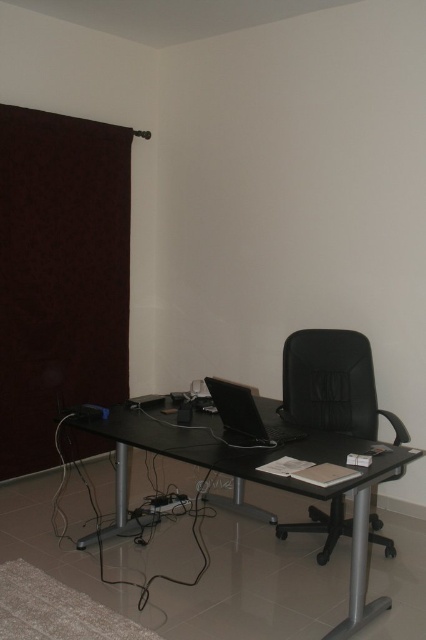
Question: From the image, what is the correct spatial relationship of black mesh office chair at center in relation to black glossy laptop at center?

Choices:
 (A) right
 (B) left

Answer: (A)

Question: Which of the following is the closest to the observer?

Choices:
 (A) dark brown fabric curtain at left
 (B) black mesh office chair at center
 (C) black glass computer desk at center

Answer: (C)

Question: Among these objects, which one is farthest from the camera?

Choices:
 (A) black glass computer desk at center
 (B) black mesh office chair at center
 (C) dark brown fabric curtain at left
 (D) black glossy laptop at center

Answer: (C)

Question: Among these points, which one is farthest from the camera?

Choices:
 (A) (9, 180)
 (B) (213, 380)
 (C) (291, 397)

Answer: (A)

Question: Can you confirm if dark brown fabric curtain at left is positioned to the left of black mesh office chair at center?

Choices:
 (A) no
 (B) yes

Answer: (B)

Question: Does black glass computer desk at center appear on the right side of black mesh office chair at center?

Choices:
 (A) no
 (B) yes

Answer: (A)